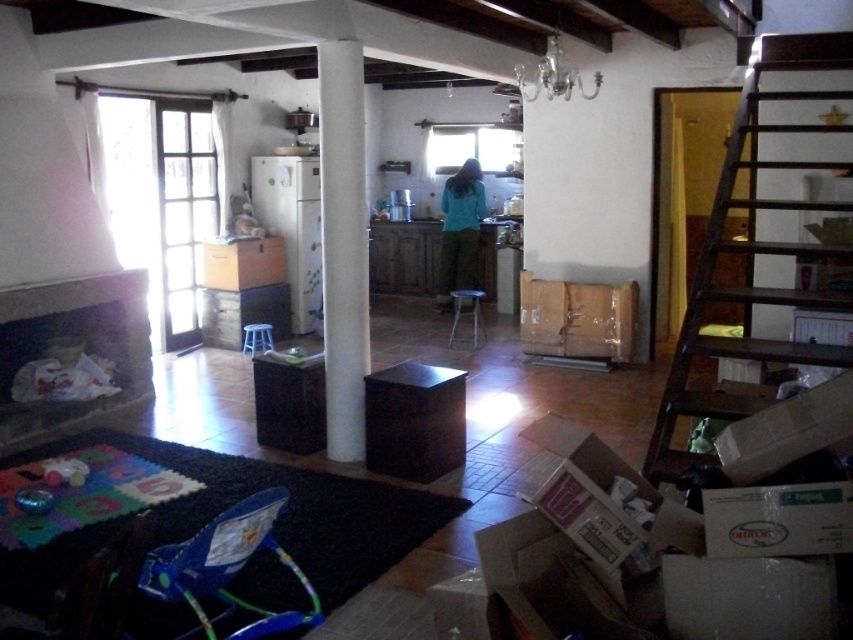
Question: Which point is farther from the camera taking this photo?

Choices:
 (A) (466, 307)
 (B) (171, 596)

Answer: (A)

Question: Does brown cardboard box at center have a larger size compared to matte black stool at center?

Choices:
 (A) no
 (B) yes

Answer: (B)

Question: Which point is farther to the camera?

Choices:
 (A) white matte pillar at center
 (B) blue plastic walker at lower left
 (C) black matte cabinet at center
 (D) brown cardboard box at center

Answer: (D)

Question: Can you confirm if black matte cabinet at center is positioned below blue plastic stool at center?

Choices:
 (A) yes
 (B) no

Answer: (A)

Question: Does white matte pillar at center have a smaller size compared to blue plastic stool at center?

Choices:
 (A) yes
 (B) no

Answer: (B)

Question: Which object is the farthest from the blue plastic stool at center?

Choices:
 (A) matte black stool at center
 (B) white matte pillar at center
 (C) black matte cabinet at center

Answer: (C)